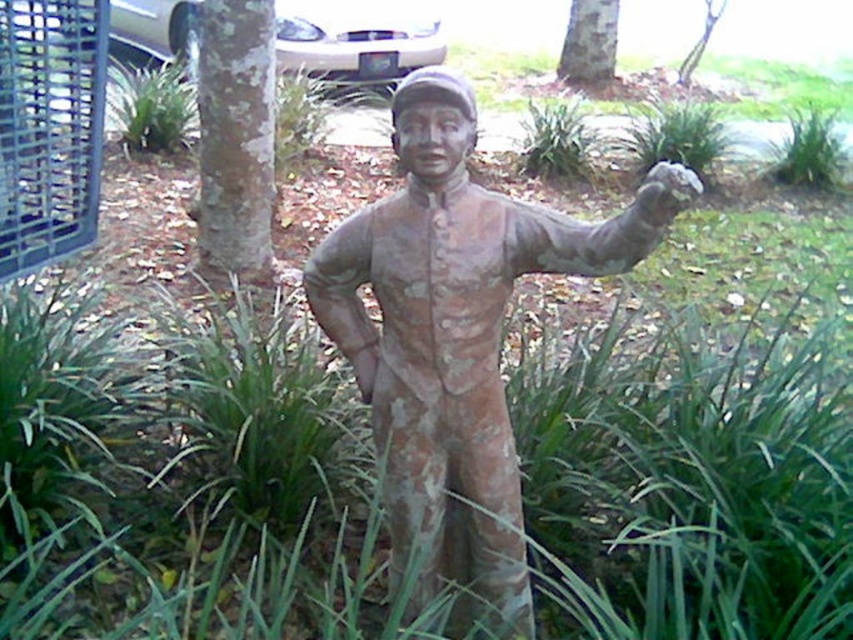
Which is in front, point (598, 76) or point (683, 86)?

Point (598, 76) is more forward.

Does smooth bark tree at center have a lesser height compared to green leafy tree at center?

Indeed, smooth bark tree at center has a lesser height compared to green leafy tree at center.

The image size is (853, 640). Describe the element at coordinates (589, 44) in the screenshot. I see `smooth bark tree at center` at that location.

The height and width of the screenshot is (640, 853). I want to click on smooth bark tree at center, so click(589, 44).

Does brown rough bark at center have a larger size compared to smooth bark tree at center?

Yes, brown rough bark at center is bigger than smooth bark tree at center.

Which is more to the right, brown rough bark at center or smooth bark tree at center?

From the viewer's perspective, smooth bark tree at center appears more on the right side.

Does point (268, 20) come behind point (564, 44)?

No, it is not.

The image size is (853, 640). I want to click on brown rough bark at center, so click(235, 140).

Which is above, rusty bronze statue at center or smooth bark tree at center?

smooth bark tree at center

Can you confirm if rusty bronze statue at center is shorter than smooth bark tree at center?

No, rusty bronze statue at center is not shorter than smooth bark tree at center.

Which is behind, point (454, 360) or point (595, 28)?

Point (595, 28)

You are a GUI agent. You are given a task and a screenshot of the screen. Output one action in this format:
    pyautogui.click(x=<x>, y=<y>)
    Task: Click on the rusty bronze statue at center
    
    Given the screenshot: What is the action you would take?
    pyautogui.click(x=457, y=336)